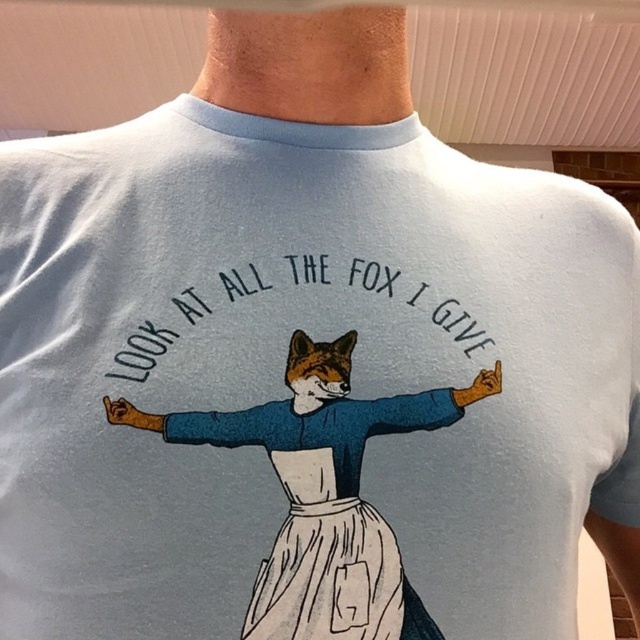
Question: Does blue fabric arm at center have a greater width compared to matte blue arm at center?

Choices:
 (A) no
 (B) yes

Answer: (B)

Question: Is blue fabric arm at center to the right of matte blue arm at center from the viewer's perspective?

Choices:
 (A) no
 (B) yes

Answer: (A)

Question: In this image, where is blue fabric arm at center located relative to matte blue arm at center?

Choices:
 (A) left
 (B) right

Answer: (A)

Question: Which is farther from the white cotton dress at center?

Choices:
 (A) matte blue arm at center
 (B) blue fabric arm at center

Answer: (A)

Question: Which object is closer to the camera taking this photo?

Choices:
 (A) blue fabric arm at center
 (B) matte blue arm at center
 (C) white cotton dress at center

Answer: (C)

Question: Which point is farther from the camera taking this photo?

Choices:
 (A) (193, 419)
 (B) (346, 584)
 (C) (372, 433)

Answer: (C)